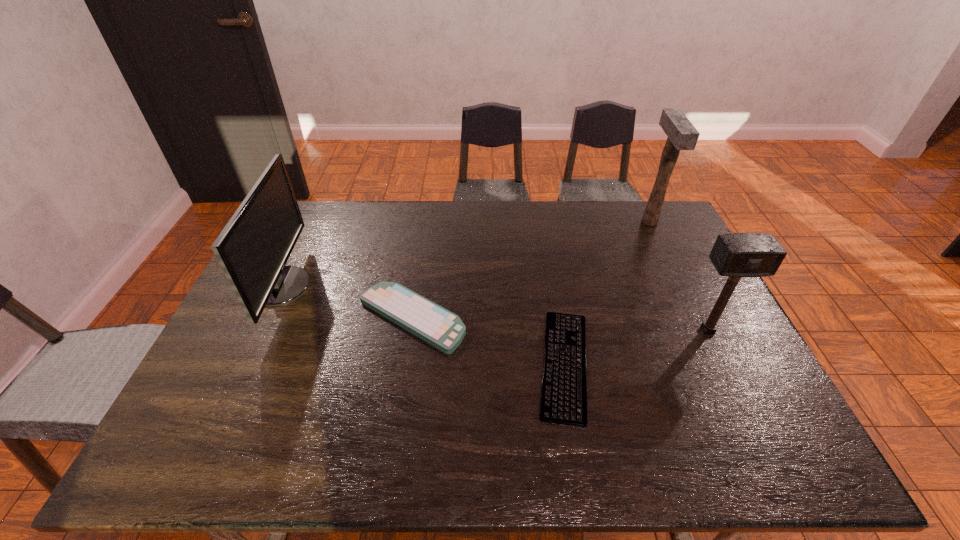
Locate an element on the screen. vacant space at the far right corner of the desktop is located at coordinates (650, 230).

Where is `free space that is in between the taller mallet and the monitor`? This screenshot has height=540, width=960. free space that is in between the taller mallet and the monitor is located at coordinates (466, 254).

You are a GUI agent. You are given a task and a screenshot of the screen. Output one action in this format:
    pyautogui.click(x=<x>, y=<y>)
    Task: Click on the free area in between the right computer keyboard and the nearer mallet
    This screenshot has width=960, height=540.
    Given the screenshot: What is the action you would take?
    pyautogui.click(x=636, y=347)

This screenshot has width=960, height=540. Find the location of `free space that is in between the left computer keyboard and the leftmost object`. free space that is in between the left computer keyboard and the leftmost object is located at coordinates (347, 302).

Where is `unoccupied position between the third object from left to right and the taller mallet`? The image size is (960, 540). unoccupied position between the third object from left to right and the taller mallet is located at coordinates (607, 293).

Find the location of `vacant space in between the fourth tallest object and the shorter computer keyboard`. vacant space in between the fourth tallest object and the shorter computer keyboard is located at coordinates (488, 341).

You are a GUI agent. You are given a task and a screenshot of the screen. Output one action in this format:
    pyautogui.click(x=<x>, y=<y>)
    Task: Click on the vacant region between the farther mallet and the shorter mallet
    This screenshot has height=540, width=960.
    Given the screenshot: What is the action you would take?
    pyautogui.click(x=679, y=276)

The height and width of the screenshot is (540, 960). I want to click on vacant point located between the monitor and the fourth tallest object, so click(347, 302).

Find the location of a particular element. This screenshot has width=960, height=540. vacant area between the shorter computer keyboard and the shorter mallet is located at coordinates (636, 347).

Identify the location of vacant region between the taller computer keyboard and the monitor. This screenshot has width=960, height=540. (347, 302).